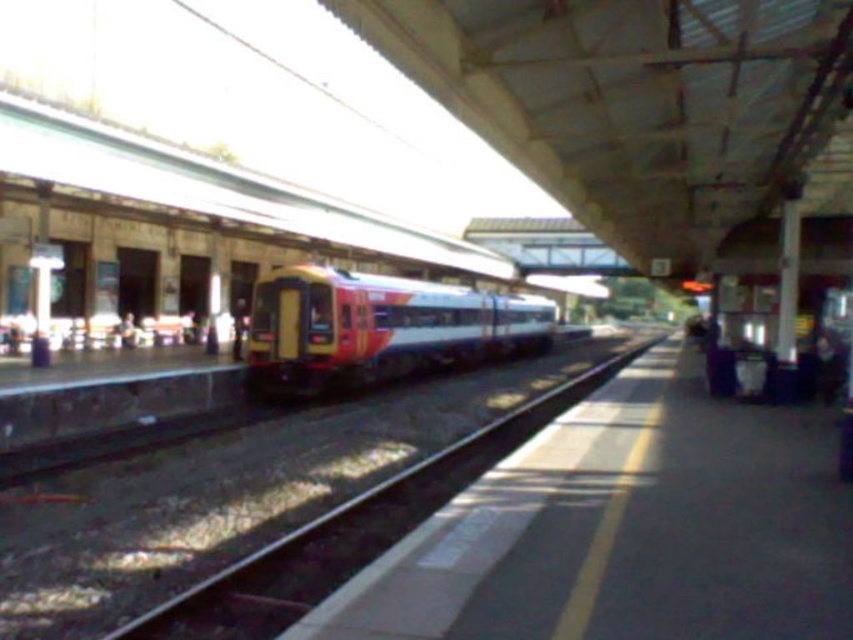
Does point (294, 374) come in front of point (119, 636)?

That is False.

Is yellow and red plastic train at center to the right of smooth metal track at center from the viewer's perspective?

No, yellow and red plastic train at center is not to the right of smooth metal track at center.

Who is more distant from viewer, (254,358) or (521,444)?

Positioned behind is point (254,358).

The image size is (853, 640). I want to click on yellow and red plastic train at center, so click(378, 326).